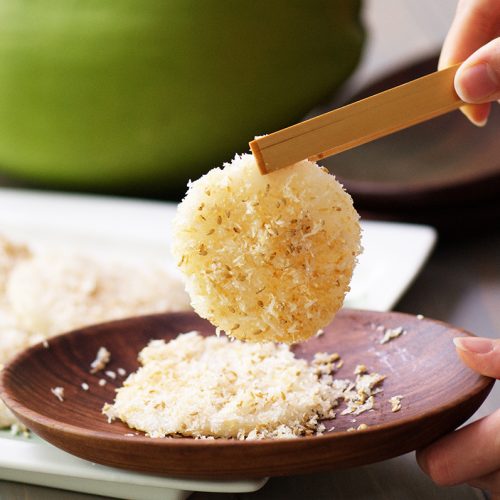
Identify the location of tabletop. (33, 487), (475, 300).